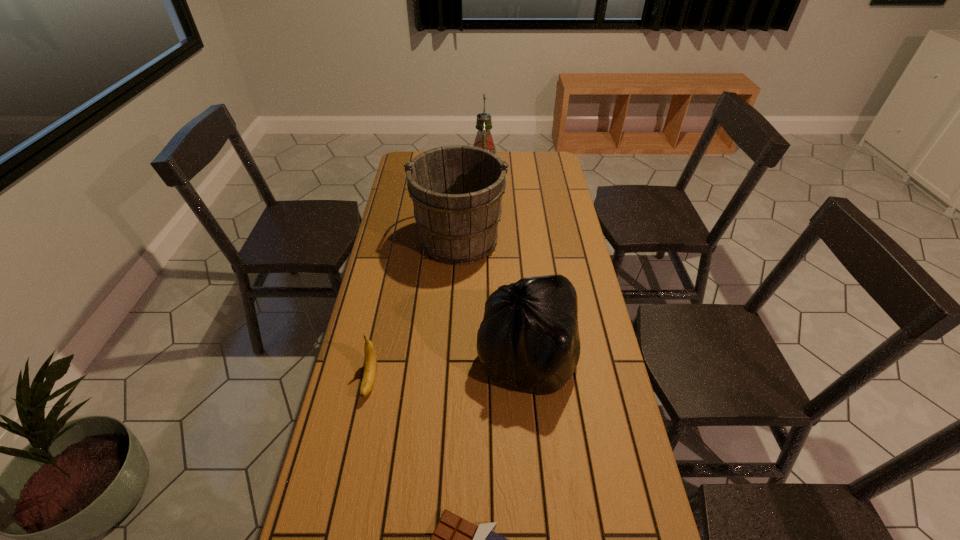
Image resolution: width=960 pixels, height=540 pixels. In order to click on vacant area that lies between the farthest object and the fourth tallest object in this screenshot , I will do `click(427, 278)`.

The height and width of the screenshot is (540, 960). Find the location of `empty space that is in between the bucket and the fourth tallest object`. empty space that is in between the bucket and the fourth tallest object is located at coordinates (x=415, y=309).

What are the coordinates of `vacant point located between the second shortest object and the farthest object` in the screenshot? It's located at (427, 278).

Identify the location of vacant area that lies between the leftmost object and the oil lamp. click(427, 278).

Locate which object is the closest to the farthest object. Please provide its 2D coordinates. Your answer should be formatted as a tuple, i.e. [(x, y)], where the tuple contains the x and y coordinates of a point satisfying the conditions above.

[(456, 190)]

You are a GUI agent. You are given a task and a screenshot of the screen. Output one action in this format:
    pyautogui.click(x=<x>, y=<y>)
    Task: Click on the object that is the second closest to the second shortest object
    The image size is (960, 540).
    Given the screenshot: What is the action you would take?
    pyautogui.click(x=454, y=539)

Locate an element on the screen. The width and height of the screenshot is (960, 540). free space that satisfies the following two spatial constraints: 1. on the handle side of the second farthest object; 2. on the left side of the farthest object is located at coordinates (463, 177).

Where is `vacant space that satisfies the following two spatial constraints: 1. on the front side of the plastic bag; 2. on the right side of the farthest object`? The width and height of the screenshot is (960, 540). vacant space that satisfies the following two spatial constraints: 1. on the front side of the plastic bag; 2. on the right side of the farthest object is located at coordinates [486, 356].

What are the coordinates of `blank space that satisfies the following two spatial constraints: 1. on the handle side of the fourth nearest object; 2. on the right side of the oil lamp` in the screenshot? It's located at 463,177.